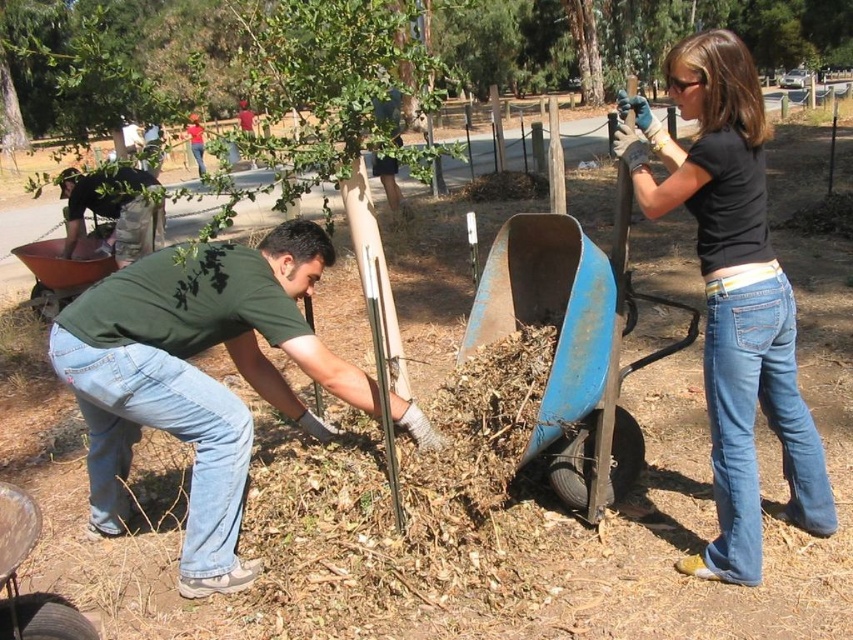
Question: Which point is farther from the camera taking this photo?

Choices:
 (A) (793, 508)
 (B) (51, 131)
 (C) (286, 353)
 (D) (608, 493)

Answer: (B)

Question: Can you confirm if green matte shirt at lower left is bigger than green leafy tree at upper center?

Choices:
 (A) no
 (B) yes

Answer: (A)

Question: Which object is positioned farthest from the blue metal cart at lower center?

Choices:
 (A) camouflage pants at left
 (B) green matte shirt at lower left
 (C) green leafy tree at upper center

Answer: (C)

Question: Is blue metal cart at lower center below camouflage pants at left?

Choices:
 (A) no
 (B) yes

Answer: (B)

Question: Which point appears farthest from the camera in this image?

Choices:
 (A) (408, 403)
 (B) (724, 390)

Answer: (A)

Question: Can you confirm if green leafy tree at upper center is positioned to the left of blue metal cart at lower center?

Choices:
 (A) no
 (B) yes

Answer: (B)